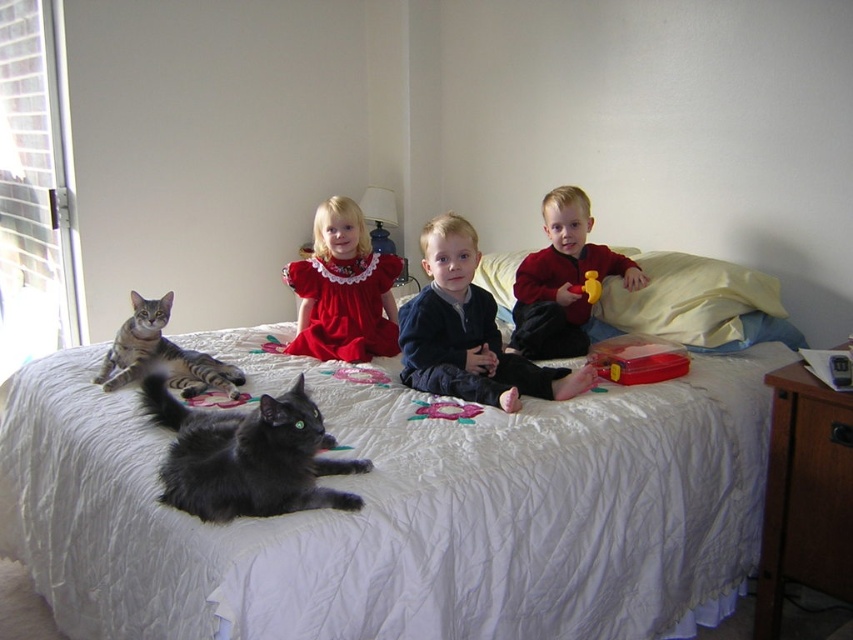
Does smooth blue sweater at center have a greater height compared to matte red dress at center?

Indeed, smooth blue sweater at center has a greater height compared to matte red dress at center.

Locate an element on the screen. smooth blue sweater at center is located at coordinates (468, 332).

Image resolution: width=853 pixels, height=640 pixels. What do you see at coordinates (468, 332) in the screenshot?
I see `smooth blue sweater at center` at bounding box center [468, 332].

I want to click on smooth blue sweater at center, so coord(468,332).

Is matte red dress at center shorter than soft plush cat at center?

No, matte red dress at center is not shorter than soft plush cat at center.

Is matte red dress at center further to the viewer compared to soft plush cat at center?

Yes, matte red dress at center is behind soft plush cat at center.

This screenshot has width=853, height=640. Find the location of `matte red dress at center`. matte red dress at center is located at coordinates (343, 289).

Does point (578, 252) come closer to viewer compared to point (111, 372)?

No, (578, 252) is behind (111, 372).

How distant is velvet red sweater at center from tabby fur cat at left?

velvet red sweater at center and tabby fur cat at left are 3.46 feet apart from each other.

This screenshot has width=853, height=640. I want to click on velvet red sweater at center, so 561,280.

You are a GUI agent. You are given a task and a screenshot of the screen. Output one action in this format:
    pyautogui.click(x=<x>, y=<y>)
    Task: Click on the velvet red sweater at center
    This screenshot has width=853, height=640.
    Given the screenshot: What is the action you would take?
    pyautogui.click(x=561, y=280)